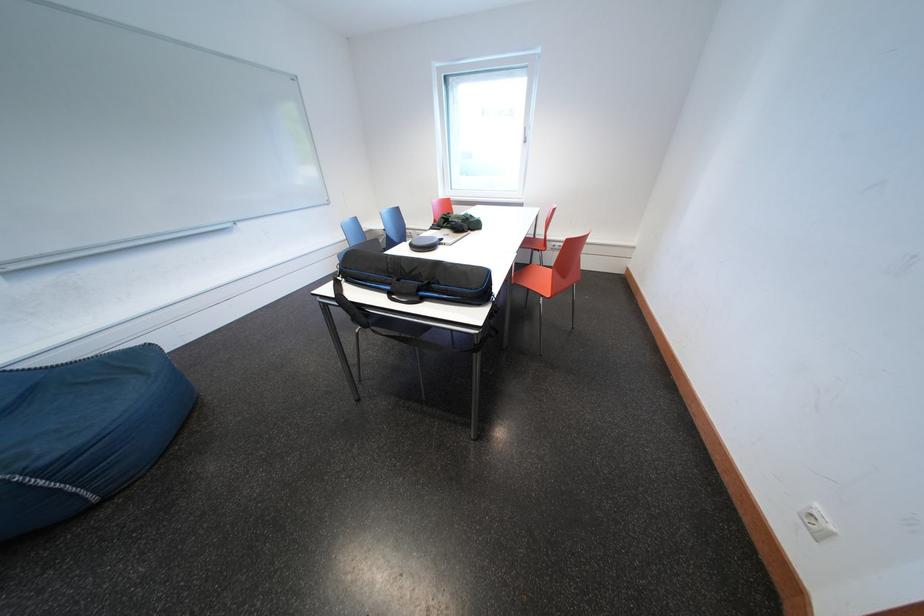
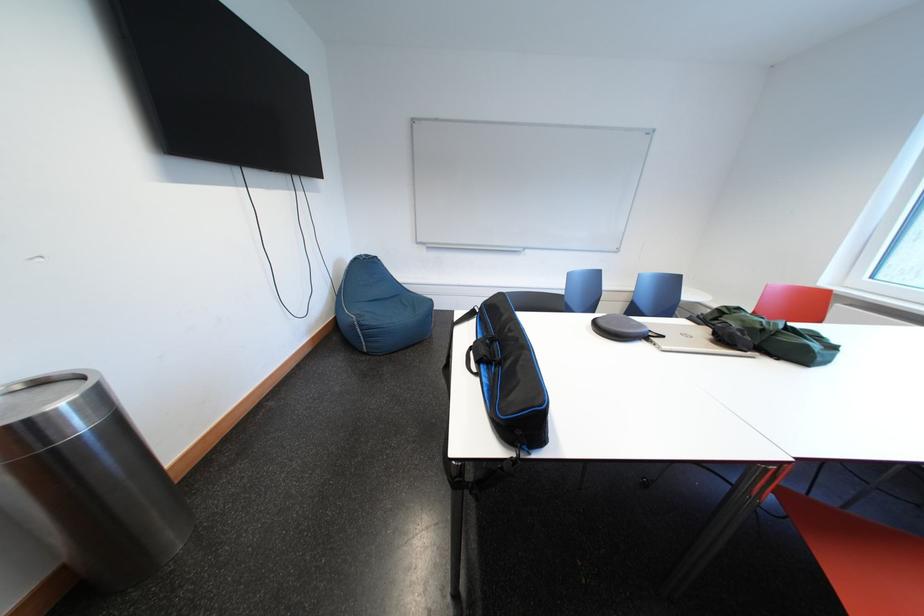
In the second image, find the point that corresponds to (46,477) in the first image.

(370, 330)